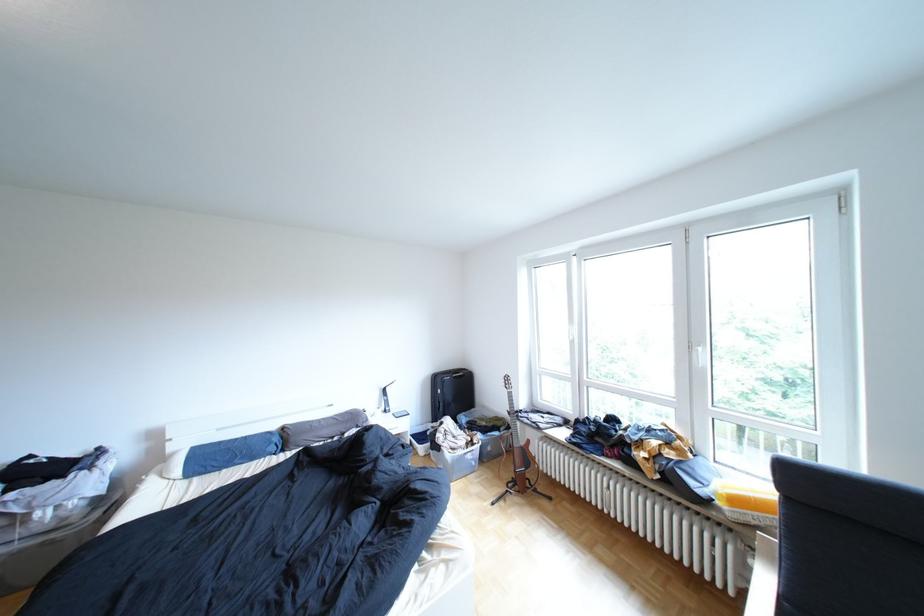
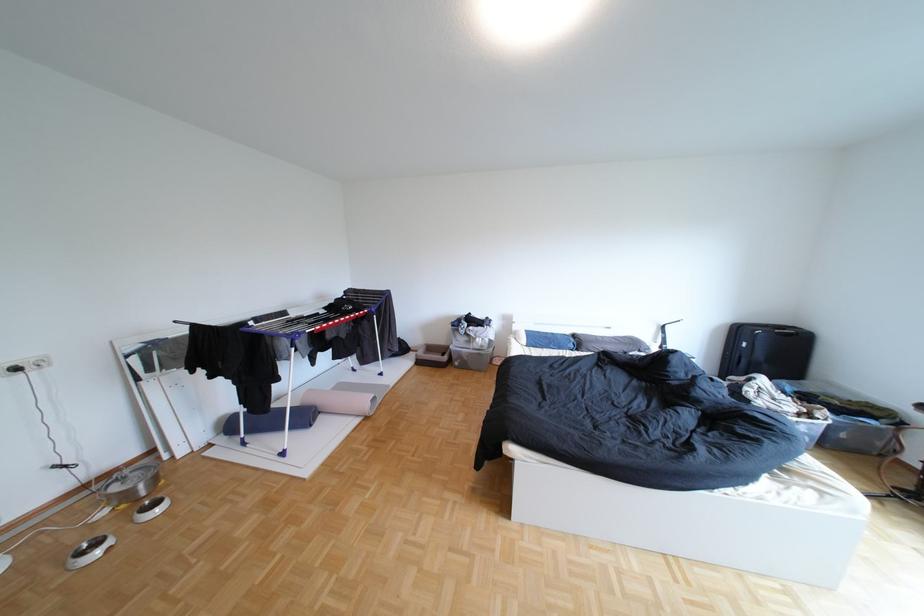
Question: Based on the continuous images, in which direction is the camera rotating? Reply with the corresponding letter.

Choices:
 (A) Left
 (B) Right
 (C) Up
 (D) Down

Answer: (A)